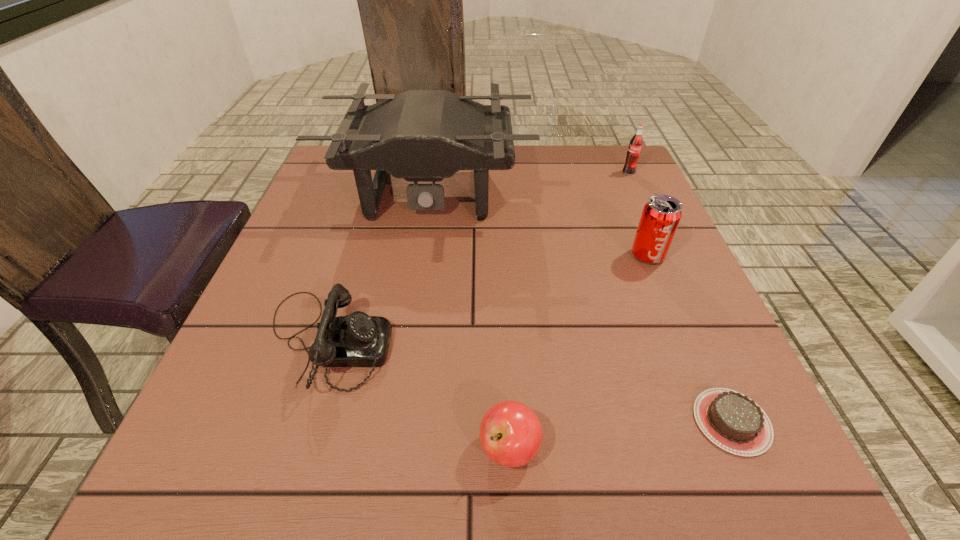
Locate an element on the screen. The height and width of the screenshot is (540, 960). object that is at the far right corner is located at coordinates (634, 150).

Find the location of a particular element. object that is at the near right corner is located at coordinates (731, 420).

At what (x,y) coordinates should I click in order to perform the action: click on free space at the far edge. Please return your answer as a coordinate pair (x, y). The width and height of the screenshot is (960, 540). Looking at the image, I should click on (501, 174).

In order to click on vacant space at the near edge of the desktop in this screenshot , I will do `click(371, 481)`.

The height and width of the screenshot is (540, 960). What are the coordinates of `vacant region at the left edge` in the screenshot? It's located at (299, 230).

At what (x,y) coordinates should I click in order to perform the action: click on blank space at the right edge of the desktop. Please return your answer as a coordinate pair (x, y). The width and height of the screenshot is (960, 540). Looking at the image, I should click on (692, 385).

In the image, there is a desktop. Where is `blank space at the near right corner`? blank space at the near right corner is located at coordinates (780, 455).

This screenshot has width=960, height=540. Identify the location of free spot between the tallest object and the farther soda bottle. (529, 184).

Locate an element on the screen. This screenshot has width=960, height=540. vacant space in between the tallest object and the farther soda bottle is located at coordinates click(529, 184).

Where is `free spot between the nearer soda bottle and the farther soda bottle`? The image size is (960, 540). free spot between the nearer soda bottle and the farther soda bottle is located at coordinates (638, 214).